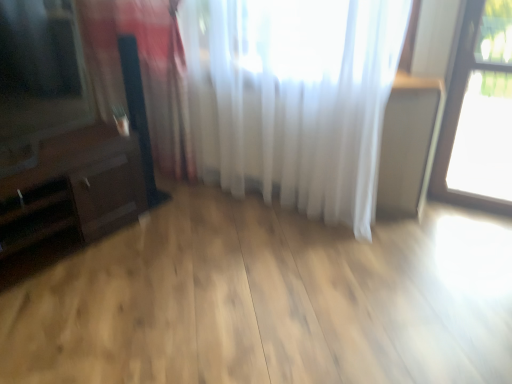
Where is `vacant space in front of white sheer curtain at upper center, placed as the 1th curtain when sorted from right to left`? The width and height of the screenshot is (512, 384). vacant space in front of white sheer curtain at upper center, placed as the 1th curtain when sorted from right to left is located at coordinates (223, 273).